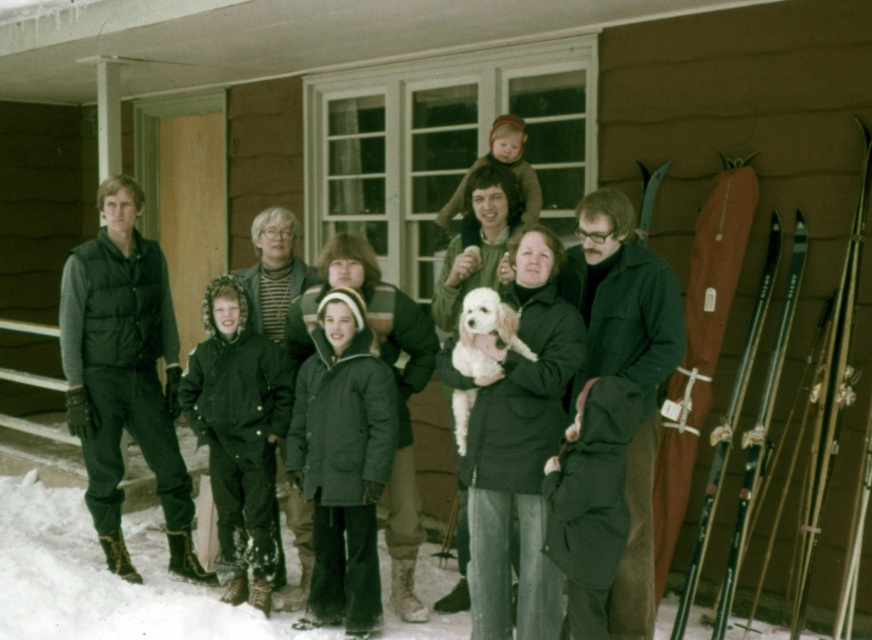
You are standing on the snow next to the wooden cabin. You see a dark green puffy coat at center and dark gray puffy jackets at center. Which one is closer to you?

The dark green puffy coat at center is closer to you because the dark gray puffy jackets at center is behind it.

You are standing at point (494, 184) and want to walk to the wooden cabin. Is point (254, 477) between you and the cabin?

Point (254, 477) is behind point (494, 184), so it is not between you and the cabin. You can walk towards the cabin without passing through point (254, 477).

You are planning to take a photo of the dark gray puffy jackets at center and the wooden skis at right. Which object should you focus on first if you want to capture both in the same frame without moving the camera?

The dark gray puffy jackets at center is much taller than the wooden skis at right, so you should focus on the dark gray puffy jackets at center first to ensure both are in frame.